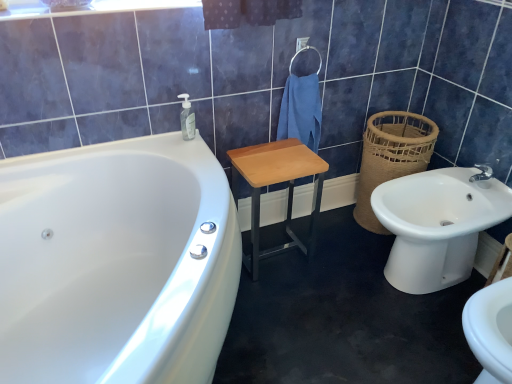
Identify the location of vacant space underneath white ceramic sink at right (from a real-world perspective). This screenshot has height=384, width=512. (415, 292).